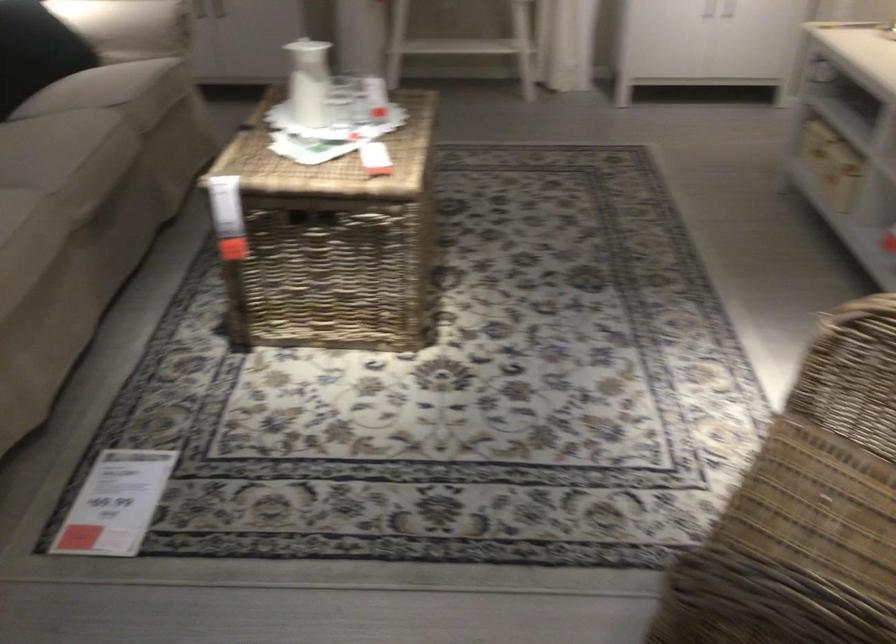
What do you see at coordinates (314, 216) in the screenshot?
I see `a wicker basket handle` at bounding box center [314, 216].